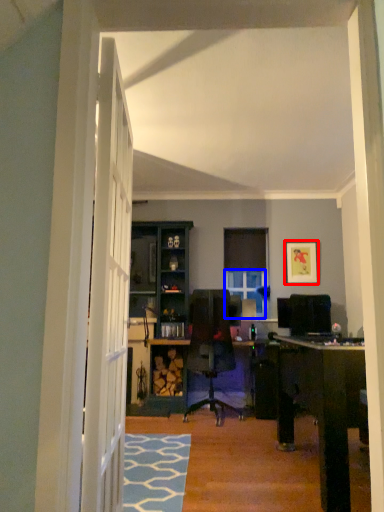
Question: Which point is closer to the camera, picture frame (highlighted by a red box) or window (highlighted by a blue box)?

Choices:
 (A) picture frame
 (B) window

Answer: (A)